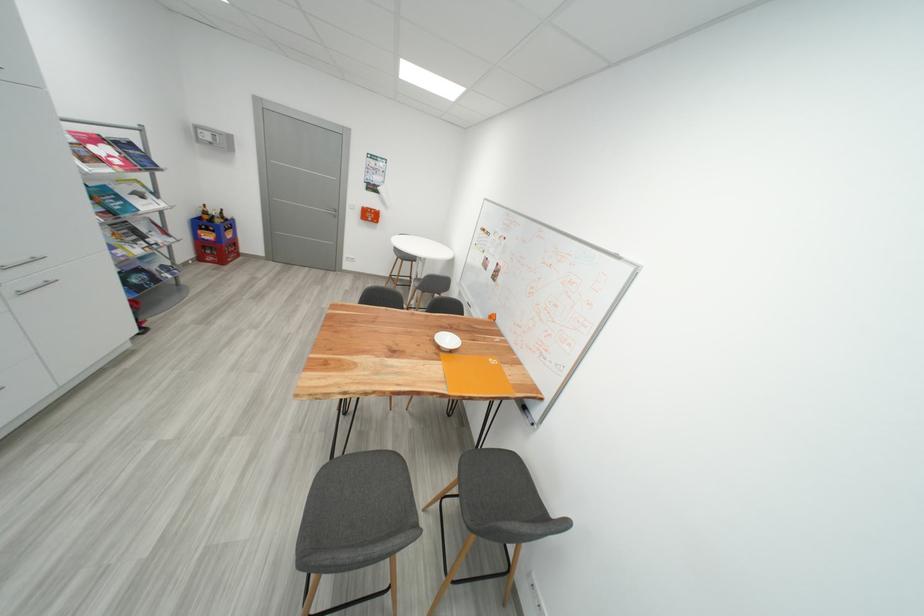
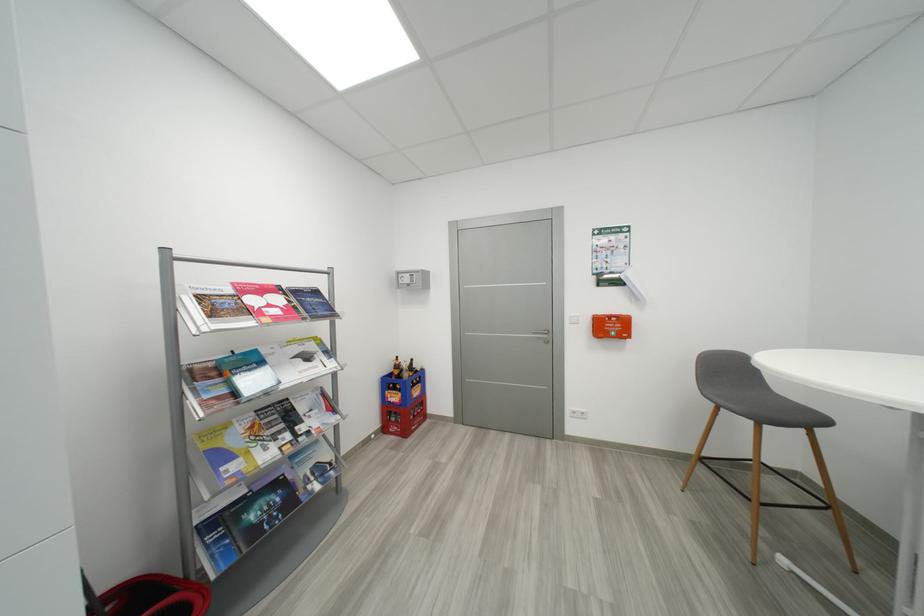
Where in the second image is the point corresponding to [378,217] from the first image?

(617, 330)